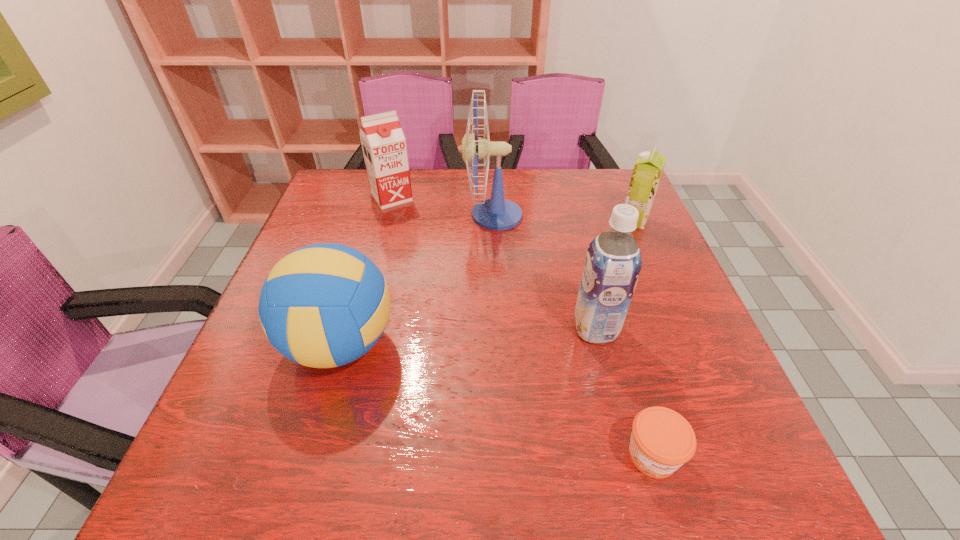
The width and height of the screenshot is (960, 540). Identify the location of free spot between the second nearest soya milk and the volleyball. (488, 282).

Identify which object is located as the fifth nearest to the second shortest soya milk. Please provide its 2D coordinates. Your answer should be formatted as a tuple, i.e. [(x, y)], where the tuple contains the x and y coordinates of a point satisfying the conditions above.

[(662, 440)]

Locate an element on the screen. This screenshot has width=960, height=540. object that is the second closest to the rightmost soya milk is located at coordinates (613, 261).

The height and width of the screenshot is (540, 960). I want to click on soya milk that is the second closest to the rightmost soya milk, so click(384, 148).

Find the location of a particular element. The width and height of the screenshot is (960, 540). the third closest soya milk to the shortest object is located at coordinates (384, 148).